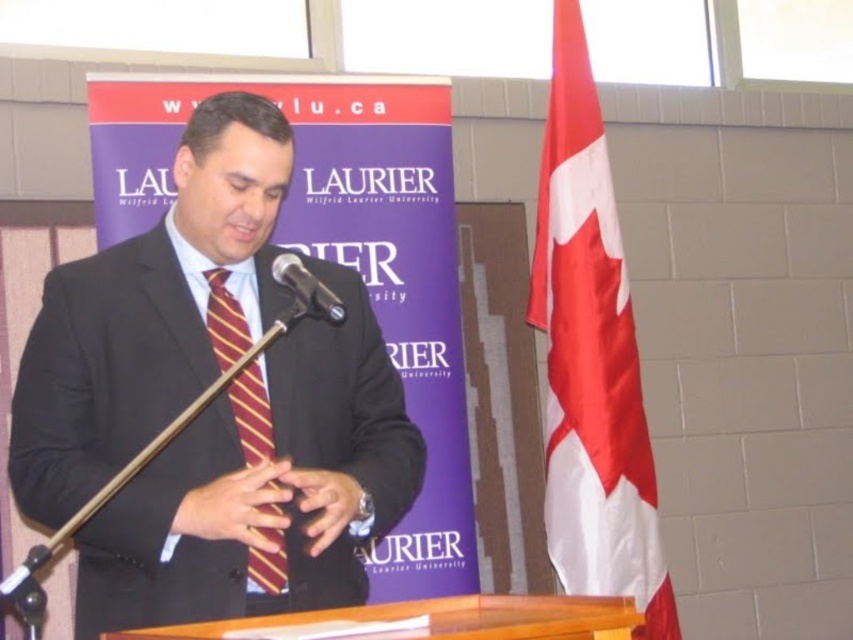
You are a stagehand setting up for a university event. You have to place a new microphone stand exactly 1.5 meters away from the silky fabric flag at right. Where should you position the stand relative to the black metallic microphone at center?

The silky fabric flag at right is 1.43 meters away from the black metallic microphone at center. To place the new microphone stand 1.5 meters from the flag, position it slightly closer to the flag than the current microphone. This would place it just behind the existing black metallic microphone at center.

You are a photographer at the event and want to capture a photo where both the silky fabric flag at right and the black metallic microphone at center are visible. Given their heights, which object will appear taller in the photo?

The silky fabric flag at right will appear taller in the photo because it has a greater height compared to the black metallic microphone at center.

You are standing in front of the podium and want to place a name tag on the exact location of the point marked at coordinate point (x=262, y=486). What object is at that point?

The matte black suit at center is located at point (x=262, y=486).